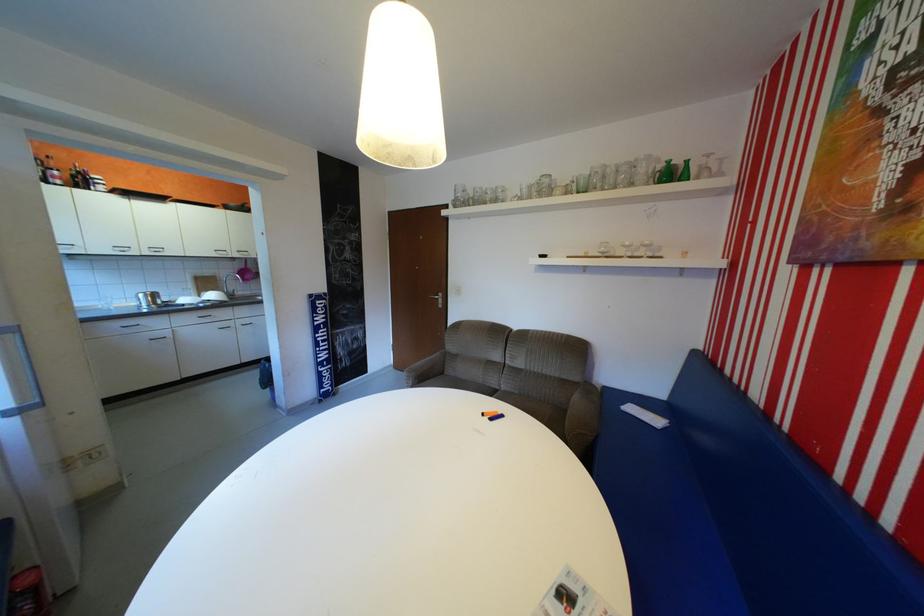
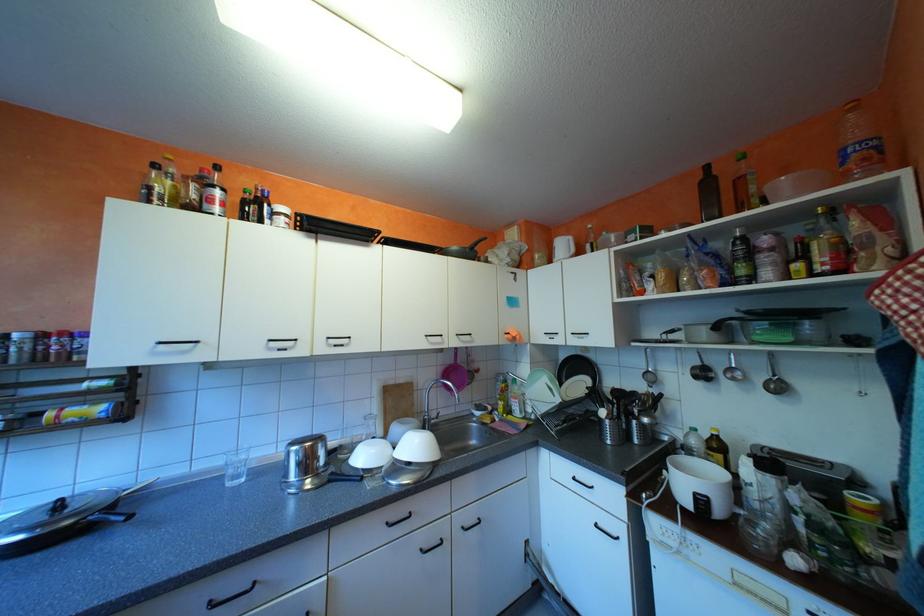
Find the pixel in the second image that matches (93,180) in the first image.

(263, 208)